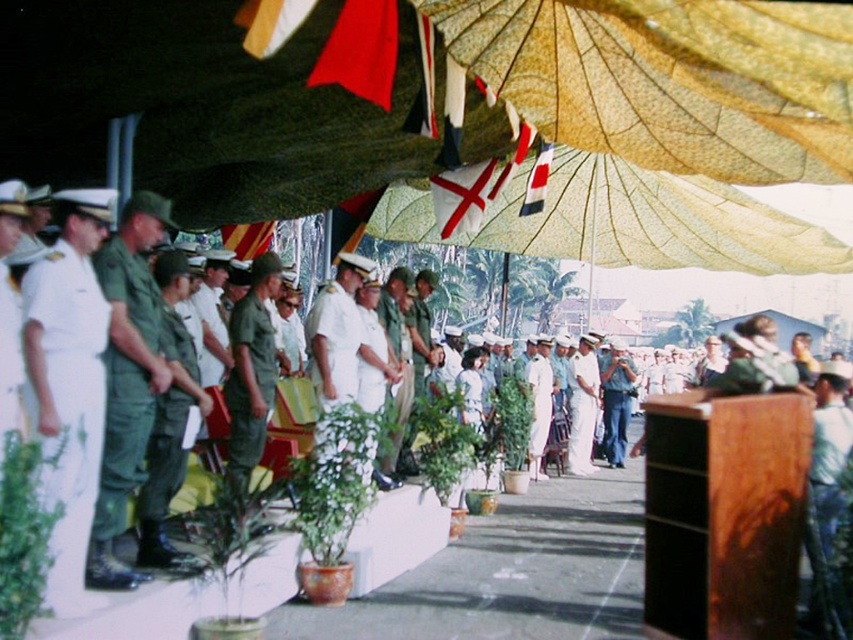
Question: Can you confirm if white matte uniform at left is positioned above white matte uniform at center?

Choices:
 (A) yes
 (B) no

Answer: (A)

Question: Which point appears closest to the camera in this image?

Choices:
 (A) (608, 435)
 (B) (68, 380)

Answer: (B)

Question: Which point is closer to the camera?

Choices:
 (A) (78, 292)
 (B) (547, 408)

Answer: (A)

Question: Which object is the closest to the white matte uniform at center?

Choices:
 (A) green matte uniform at center
 (B) denim pants at center

Answer: (B)

Question: Can you confirm if yellow fabric umbrella at center is thinner than green matte uniform at center?

Choices:
 (A) no
 (B) yes

Answer: (A)

Question: Can you confirm if white uniform at center is thinner than white matte uniform at center?

Choices:
 (A) yes
 (B) no

Answer: (B)